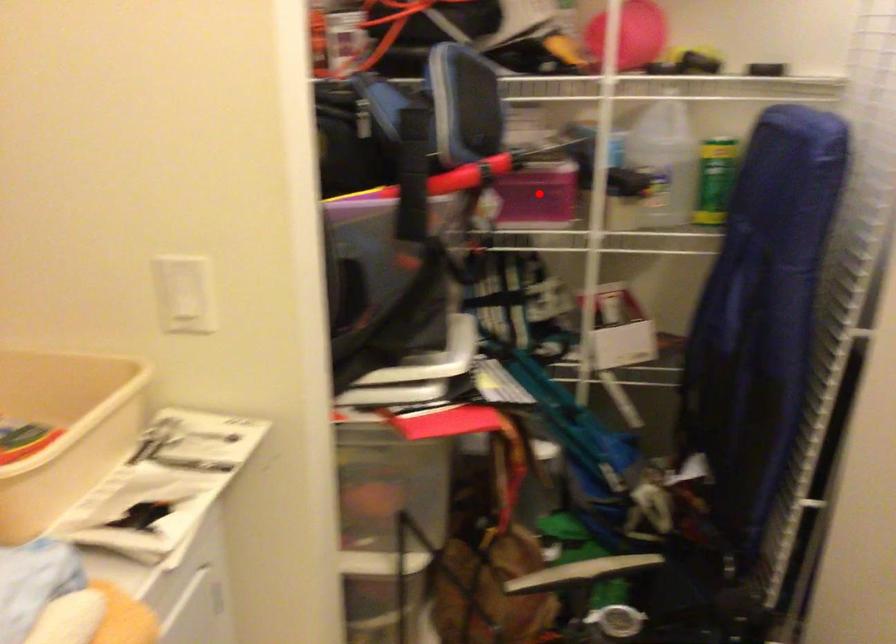
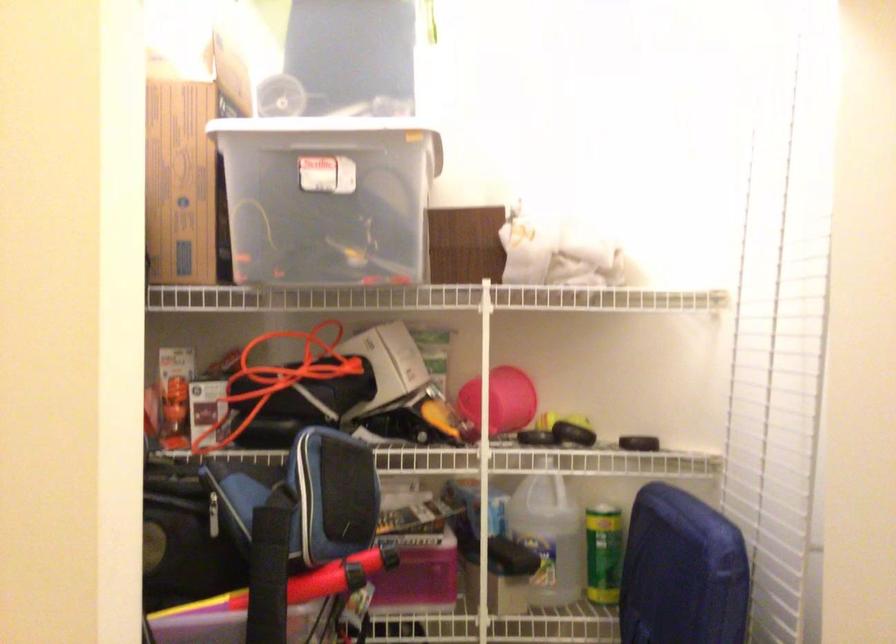
Question: I am providing you with two images of the same scene from different viewpoints. In image1, a red point is highlighted. Considering the same 3D point in image2, which of the following is correct?

Choices:
 (A) It is closer
 (B) It is farther

Answer: (A)